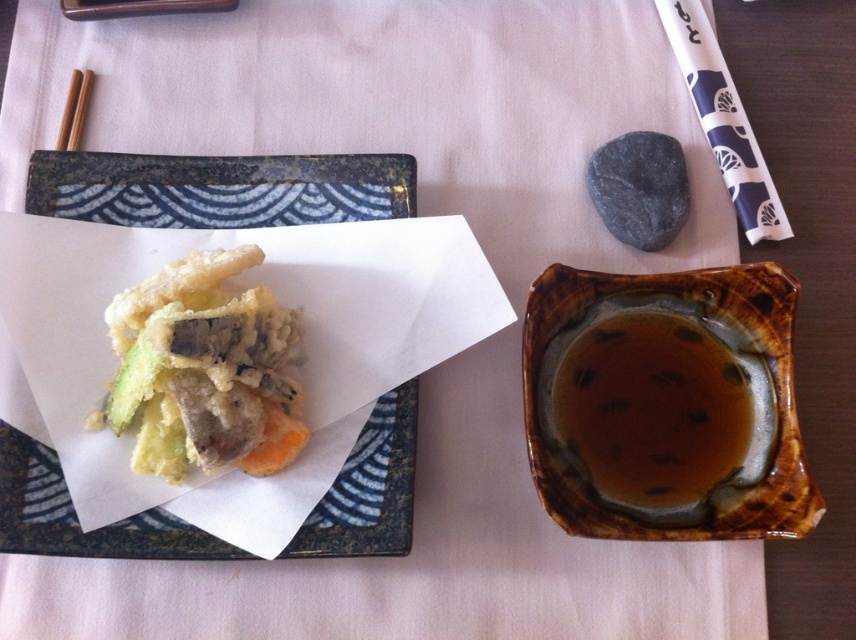
Question: Does brown glazed bowl at right appear on the right side of brown wood chopsticks at upper left?

Choices:
 (A) yes
 (B) no

Answer: (A)

Question: Which object appears farthest from the camera in this image?

Choices:
 (A) white crispy tempura at center
 (B) black stone at upper right
 (C) brown glazed bowl at upper right
 (D) textured paper plate at upper left

Answer: (B)

Question: Considering the relative positions of brown glazed bowl at upper right and brown glazed bowl at right in the image provided, where is brown glazed bowl at upper right located with respect to brown glazed bowl at right?

Choices:
 (A) right
 (B) left

Answer: (A)

Question: Is brown glazed bowl at upper right below brown wood chopsticks at upper left?

Choices:
 (A) no
 (B) yes

Answer: (B)

Question: Which of the following is the closest to the observer?

Choices:
 (A) (623, 502)
 (B) (272, 156)
 (C) (300, 440)

Answer: (A)

Question: Among these objects, which one is farthest from the camera?

Choices:
 (A) textured paper plate at upper left
 (B) white crispy tempura at center

Answer: (A)